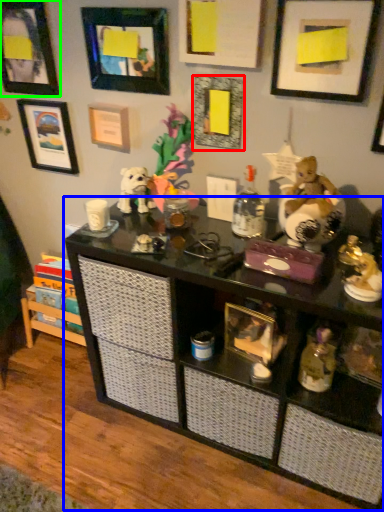
Question: Which object is the farthest from picture frame (highlighted by a red box)? Choose among these: shelf (highlighted by a blue box) or picture frame (highlighted by a green box).

Choices:
 (A) shelf
 (B) picture frame

Answer: (B)